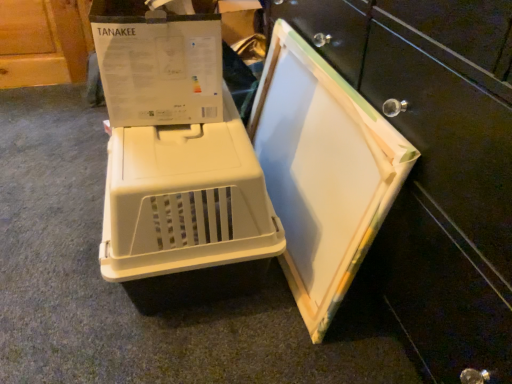
Question: Choose the correct answer: Is beige plastic crate at center inside white cardboard at center or outside it?

Choices:
 (A) inside
 (B) outside

Answer: (B)

Question: From the image's perspective, is beige plastic crate at center positioned above or below white cardboard at center?

Choices:
 (A) above
 (B) below

Answer: (B)

Question: Considering their positions, is beige plastic crate at center located in front of or behind white cardboard at center?

Choices:
 (A) front
 (B) behind

Answer: (B)

Question: From a real-world perspective, is white cardboard at center above or below beige plastic crate at center?

Choices:
 (A) above
 (B) below

Answer: (A)

Question: Would you say white cardboard at center is to the left or to the right of beige plastic crate at center in the picture?

Choices:
 (A) left
 (B) right

Answer: (B)

Question: Would you say white cardboard at center is inside or outside beige plastic crate at center?

Choices:
 (A) inside
 (B) outside

Answer: (B)

Question: Considering the positions of white cardboard at center and beige plastic crate at center in the image, is white cardboard at center bigger or smaller than beige plastic crate at center?

Choices:
 (A) big
 (B) small

Answer: (B)